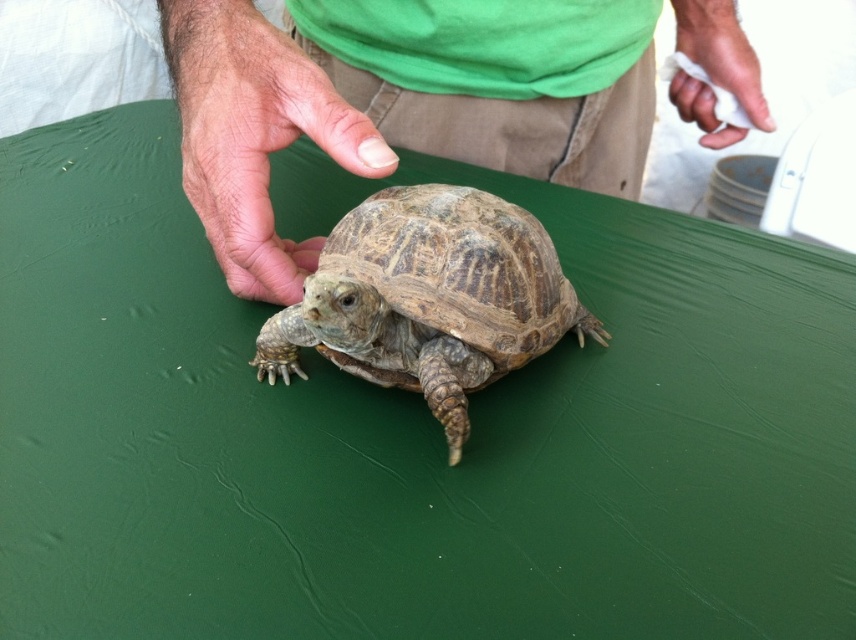
Does leathery brown tortoise at center have a lesser height compared to white paper towel at upper right?

No, leathery brown tortoise at center is not shorter than white paper towel at upper right.

Is point (444, 280) in front of point (718, 140)?

Yes.

Who is more distant from viewer, (464, 224) or (727, 132)?

The point (727, 132) is more distant.

The height and width of the screenshot is (640, 856). What are the coordinates of `leathery brown tortoise at center` in the screenshot? It's located at (431, 298).

Is green matte shirt at center to the left of fur skin hand at center from the viewer's perspective?

Incorrect, green matte shirt at center is not on the left side of fur skin hand at center.

Between green matte shirt at center and fur skin hand at center, which one has less height?

Standing shorter between the two is green matte shirt at center.

Find the location of `green matte shirt at center`. green matte shirt at center is located at coordinates (253, 134).

In order to click on green matte shirt at center in this screenshot , I will do `click(253, 134)`.

Is the position of leathery brown tortoise at center more distant than that of fur skin hand at center?

No, leathery brown tortoise at center is in front of fur skin hand at center.

Between leathery brown tortoise at center and fur skin hand at center, which one appears on the right side from the viewer's perspective?

leathery brown tortoise at center

Locate an element on the screen. leathery brown tortoise at center is located at coordinates (431, 298).